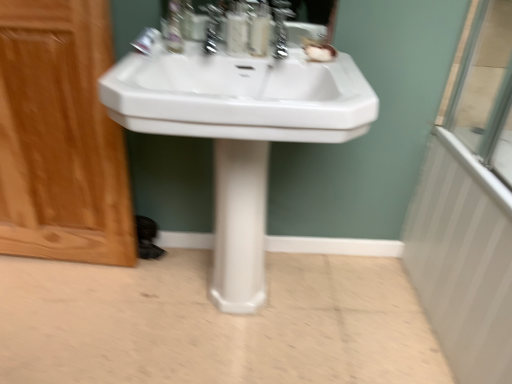
This screenshot has height=384, width=512. I want to click on empty space that is to the right of white glossy pedestal at center, so click(x=298, y=293).